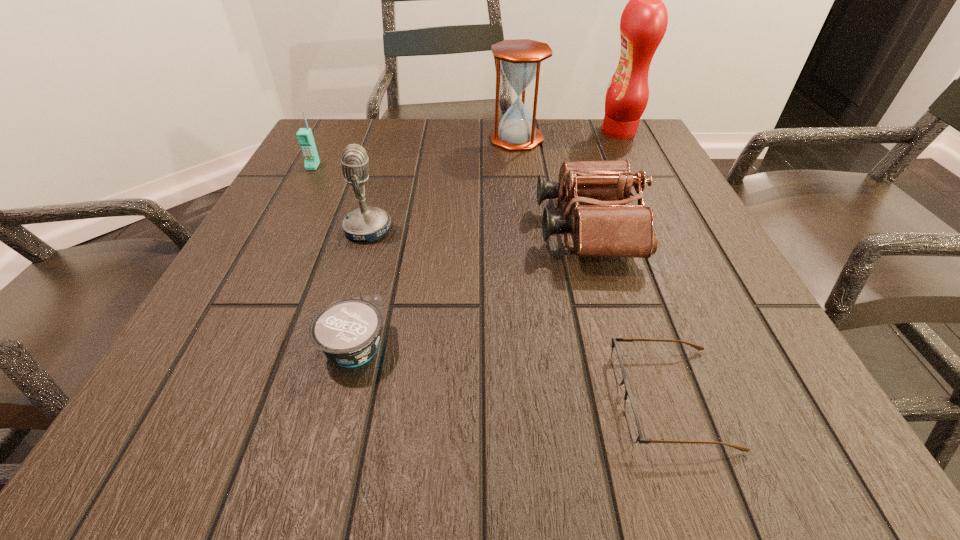
Find the location of a particular element. object that ranks as the second closest to the binoculars is located at coordinates (520, 59).

Identify the location of vacant space that satisfies the following two spatial constraints: 1. on the back side of the yogurt; 2. on the front-facing side of the microphone. (385, 230).